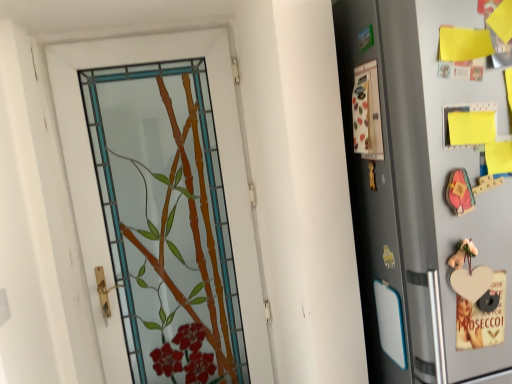
Question: Is the depth of silver metallic refrigerator at right less than that of stained glass door at center?

Choices:
 (A) yes
 (B) no

Answer: (A)

Question: Does silver metallic refrigerator at right have a greater width compared to stained glass door at center?

Choices:
 (A) no
 (B) yes

Answer: (B)

Question: Could you tell me if silver metallic refrigerator at right is turned towards stained glass door at center?

Choices:
 (A) yes
 (B) no

Answer: (B)

Question: Are silver metallic refrigerator at right and stained glass door at center beside each other?

Choices:
 (A) yes
 (B) no

Answer: (B)

Question: Is silver metallic refrigerator at right positioned beyond the bounds of stained glass door at center?

Choices:
 (A) yes
 (B) no

Answer: (A)

Question: From a real-world perspective, is stained glass door at center physically located above or below matte plastic screen door at right?

Choices:
 (A) above
 (B) below

Answer: (B)

Question: In terms of size, does stained glass door at center appear bigger or smaller than matte plastic screen door at right?

Choices:
 (A) big
 (B) small

Answer: (A)

Question: Which is correct: stained glass door at center is inside matte plastic screen door at right, or outside of it?

Choices:
 (A) inside
 (B) outside

Answer: (B)

Question: In terms of height, does stained glass door at center look taller or shorter compared to matte plastic screen door at right?

Choices:
 (A) short
 (B) tall

Answer: (B)

Question: Does point (230, 155) appear closer or farther from the camera than point (412, 261)?

Choices:
 (A) closer
 (B) farther

Answer: (B)

Question: From a real-world perspective, relative to silver metallic refrigerator at right, is stained glass door at center vertically above or below?

Choices:
 (A) above
 (B) below

Answer: (B)

Question: Is stained glass door at center bigger or smaller than silver metallic refrigerator at right?

Choices:
 (A) small
 (B) big

Answer: (A)

Question: From the image's perspective, is stained glass door at center positioned above or below silver metallic refrigerator at right?

Choices:
 (A) above
 (B) below

Answer: (B)

Question: Which is correct: silver metallic refrigerator at right is inside matte plastic screen door at right, or outside of it?

Choices:
 (A) outside
 (B) inside

Answer: (A)

Question: Is point (458, 182) closer or farther from the camera than point (385, 299)?

Choices:
 (A) closer
 (B) farther

Answer: (A)